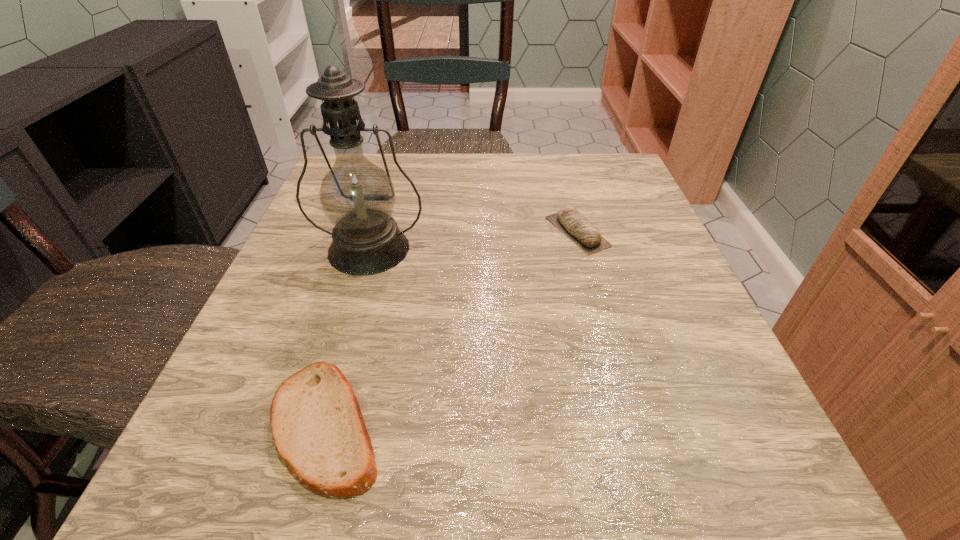
Find the location of a particular element. The width and height of the screenshot is (960, 540). free space between the left pita bread and the rightmost object is located at coordinates (452, 329).

The image size is (960, 540). I want to click on blank region between the right pita bread and the nearest object, so click(x=452, y=329).

Locate an element on the screen. Image resolution: width=960 pixels, height=540 pixels. free area in between the left pita bread and the tallest object is located at coordinates (348, 338).

Locate an element on the screen. The width and height of the screenshot is (960, 540). unoccupied position between the farther pita bread and the oil lamp is located at coordinates (473, 240).

Identify the location of unoccupied area between the oil lamp and the nearest object. (348, 338).

Find the location of a particular element. The image size is (960, 540). free space between the nearer pita bread and the rightmost object is located at coordinates (452, 329).

Where is `vacant region between the farther pita bread and the nearer pita bread`? vacant region between the farther pita bread and the nearer pita bread is located at coordinates (452, 329).

Locate an element on the screen. The height and width of the screenshot is (540, 960). vacant area that lies between the nearest object and the oil lamp is located at coordinates (348, 338).

You are a GUI agent. You are given a task and a screenshot of the screen. Output one action in this format:
    pyautogui.click(x=<x>, y=<y>)
    Task: Click on the free spot between the nearest object and the oil lamp
    
    Given the screenshot: What is the action you would take?
    pyautogui.click(x=348, y=338)

This screenshot has width=960, height=540. I want to click on object that stands as the second closest to the tallest object, so click(575, 226).